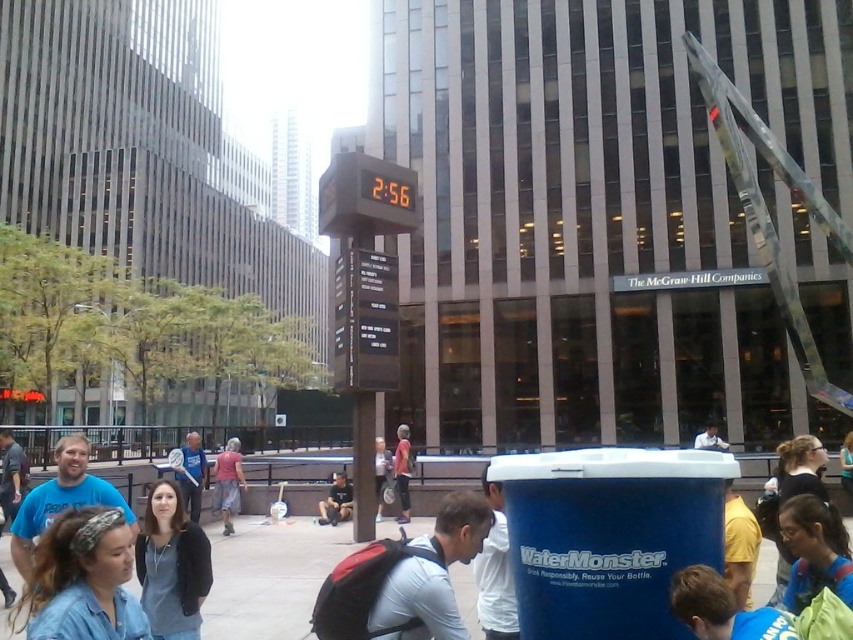
You are standing in the city plaza and see two points marked in the image. Which point is closer to you, point (x=212, y=628) or point (x=229, y=458)?

Point (x=212, y=628) is closer to the viewer than point (x=229, y=458).